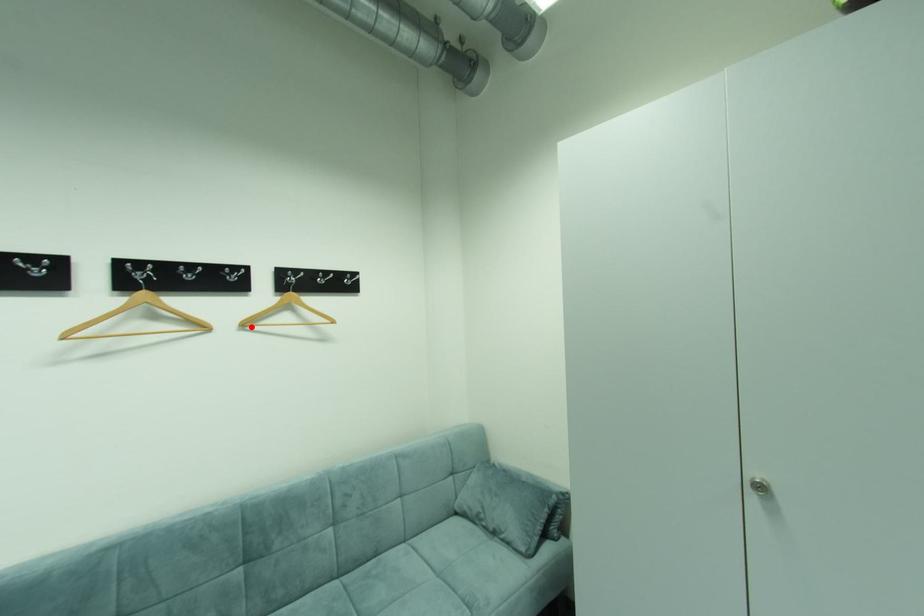
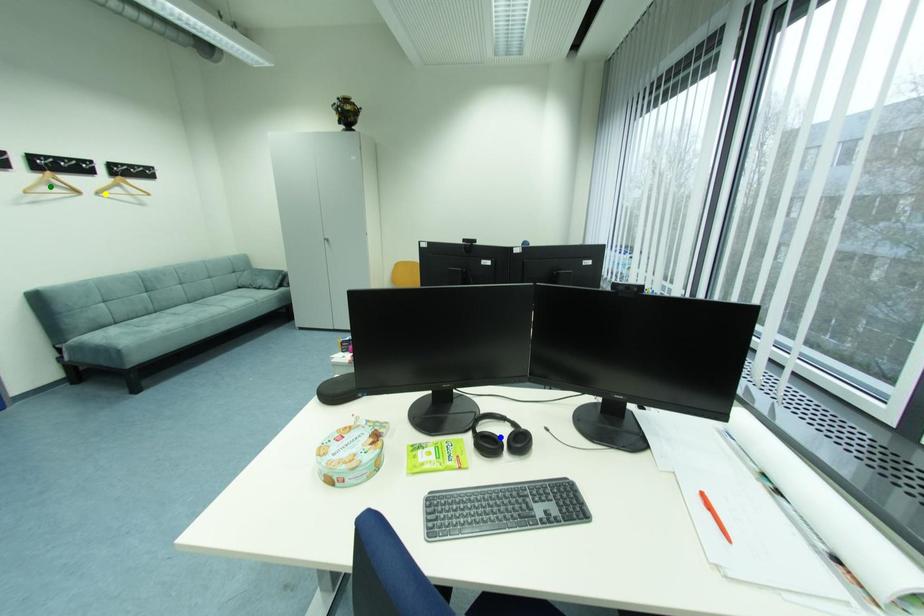
Question: I am providing you with two images of the same scene from different viewpoints. A red point is marked on the first image. You are given multiple points on the second image. Which point in image 2 is actually the same real-world point as the red point in image 1?

Choices:
 (A) green point
 (B) blue point
 (C) yellow point

Answer: (C)